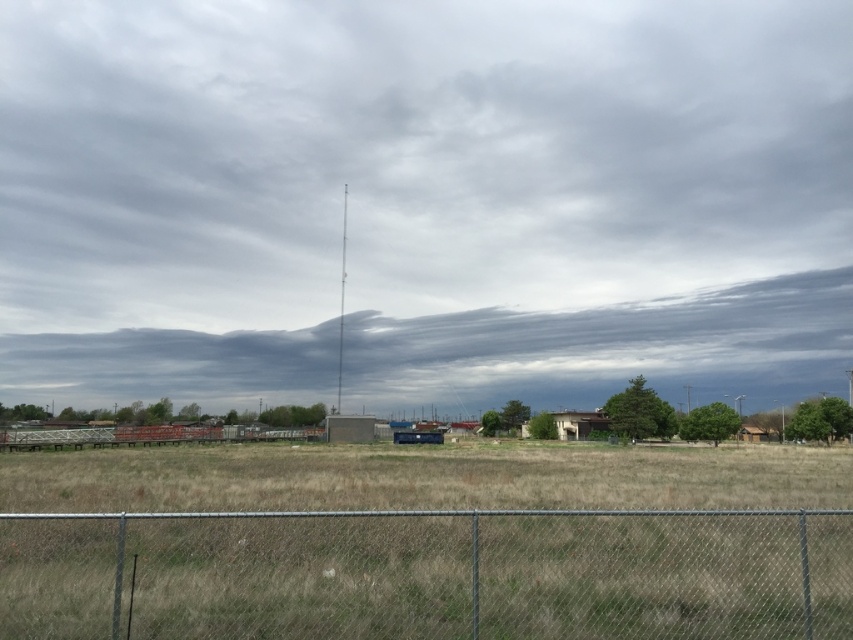
You are standing at the point with coordinates point (755, 401) and want to walk towards the point with coordinates point (695, 256). Which direction should you face to move directly towards your destination?

You should face towards the direction of the point (695, 256) because it is behind the point (755, 401), meaning you need to walk backward to reach it.